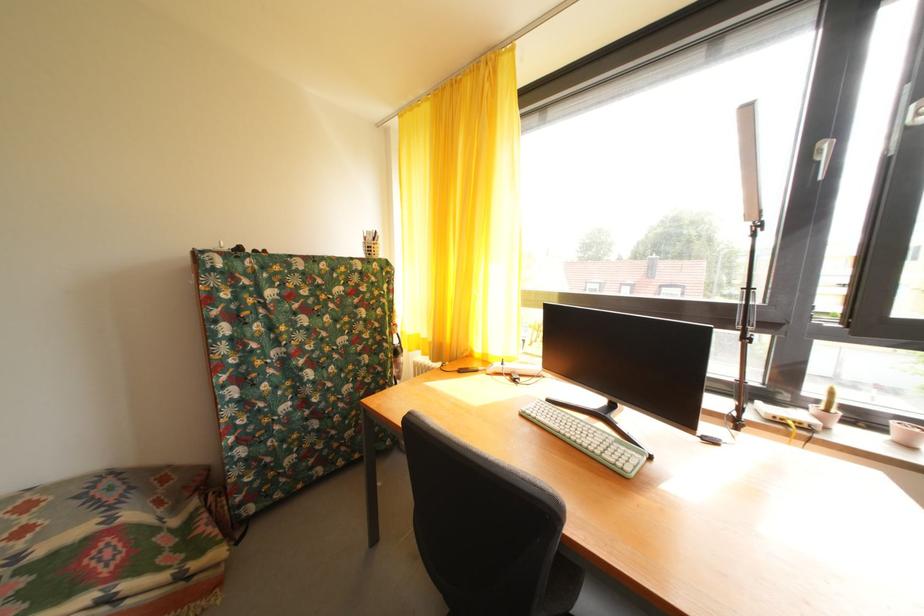
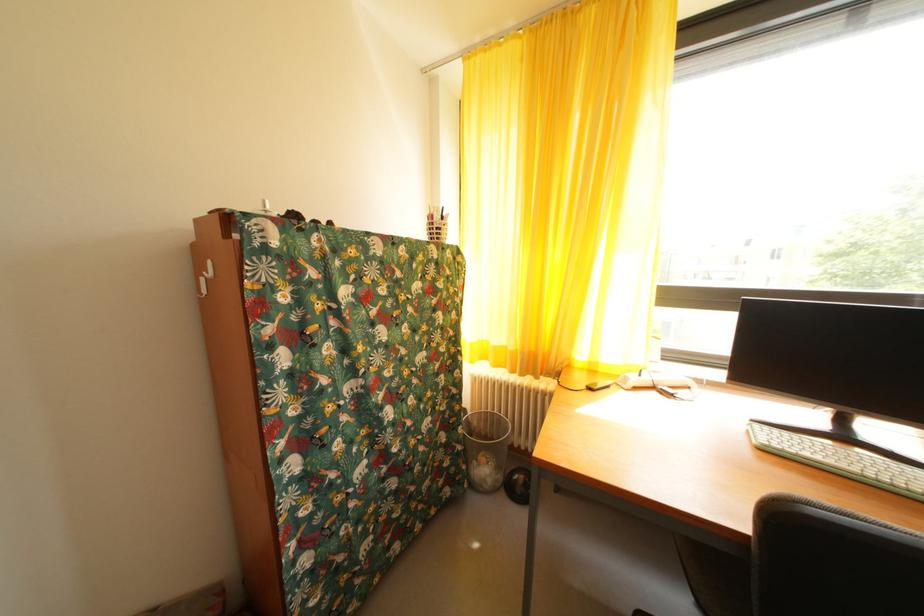
The point at (432,346) is marked in the first image. Where is the corresponding point in the second image?

(505, 354)